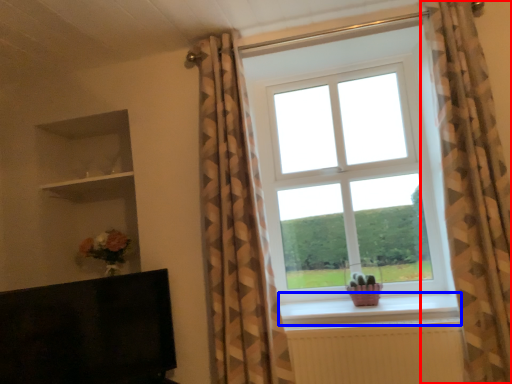
Question: Which object is further to the camera taking this photo, curtain (highlighted by a red box) or window sill (highlighted by a blue box)?

Choices:
 (A) curtain
 (B) window sill

Answer: (B)